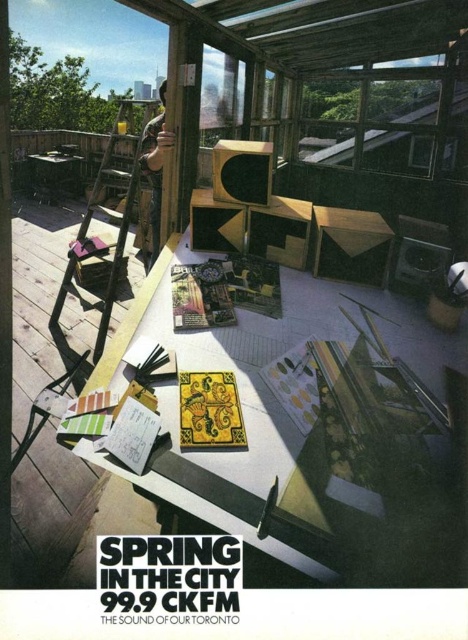
Question: Which point is closer to the camera taking this photo?

Choices:
 (A) (36, 428)
 (B) (111, 300)
 (C) (33, 307)

Answer: (A)

Question: Considering the real-world distances, which object is farthest from the wooden deck at left?

Choices:
 (A) matte black table at left
 (B) wooden ladder at left
 (C) wooden chair at lower left

Answer: (A)

Question: Is wooden deck at left wider than wooden chair at lower left?

Choices:
 (A) yes
 (B) no

Answer: (A)

Question: From the image, what is the correct spatial relationship of wooden deck at left in relation to wooden chair at lower left?

Choices:
 (A) left
 (B) right

Answer: (A)

Question: Is wooden deck at left above wooden chair at lower left?

Choices:
 (A) yes
 (B) no

Answer: (A)

Question: Which of the following is the closest to the observer?

Choices:
 (A) (56, 179)
 (B) (39, 426)

Answer: (B)